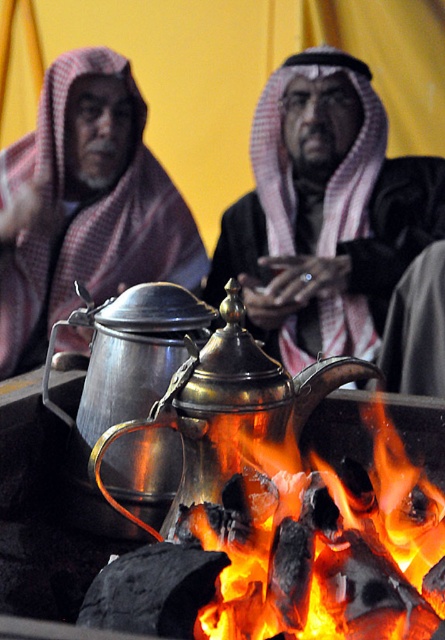
Is point (249, 212) less distant than point (257, 624)?

No.

Can you confirm if matte black robe at center is thinner than charcoal fire at lower center?

No, matte black robe at center is not thinner than charcoal fire at lower center.

The image size is (445, 640). What do you see at coordinates (324, 212) in the screenshot?
I see `matte black robe at center` at bounding box center [324, 212].

The image size is (445, 640). I want to click on matte black robe at center, so pos(324,212).

Is matte black robe at center above shiny brass teapot at center?

Correct, matte black robe at center is located above shiny brass teapot at center.

The height and width of the screenshot is (640, 445). Describe the element at coordinates (324, 212) in the screenshot. I see `matte black robe at center` at that location.

Locate an element on the screen. Image resolution: width=445 pixels, height=640 pixels. matte black robe at center is located at coordinates (324, 212).

Measure the distance between point (121, 259) and camera.

They are 2.96 meters apart.

Between point (33, 228) and point (384, 552), which one is positioned behind?

Point (33, 228)

At what (x,y) coordinates should I click in order to perform the action: click on matte black headscarf at center. Please return your answer as a coordinate pair (x, y). Looking at the image, I should click on (84, 205).

Identify the location of matte black headscarf at center. click(x=84, y=205).